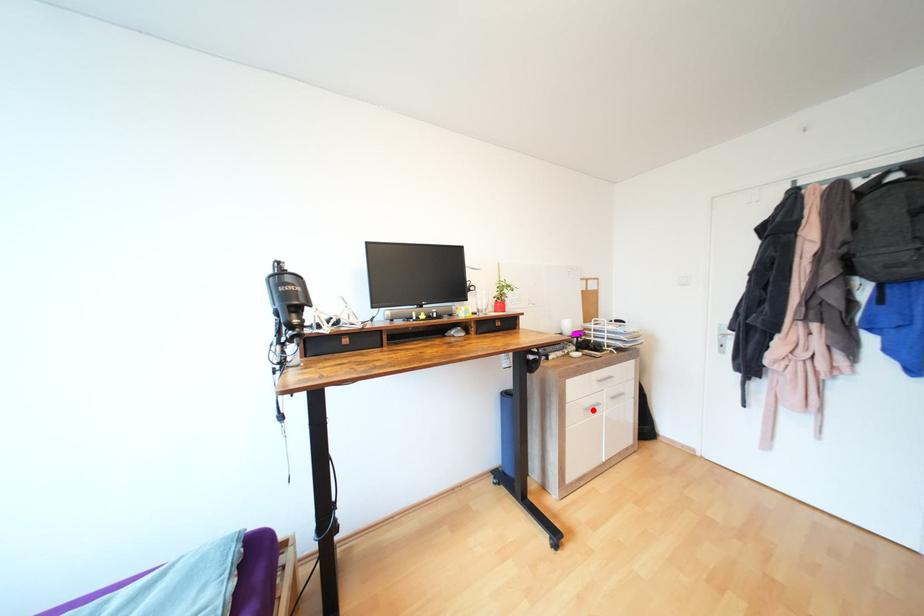
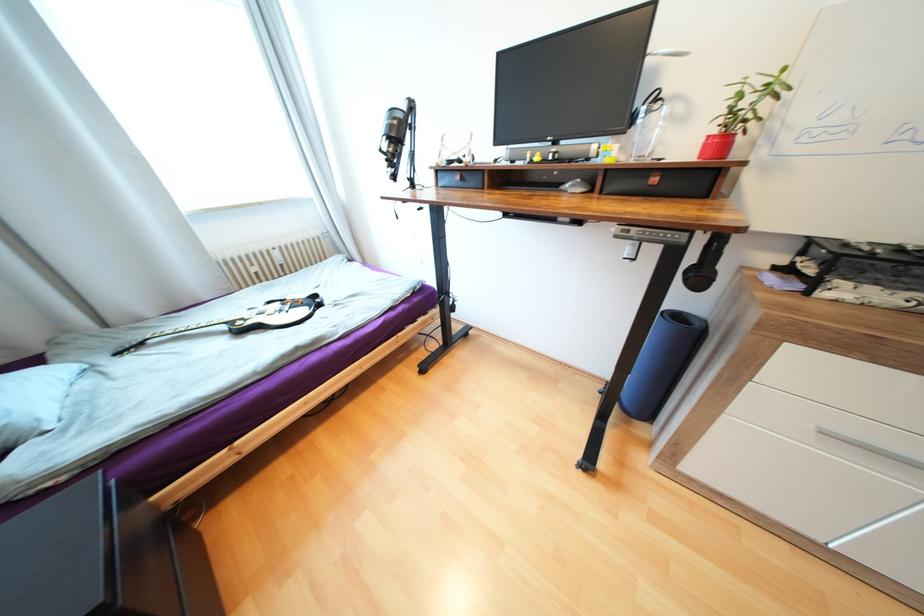
Question: I am providing you with two images of the same scene from different viewpoints. A red point is shown in image1. For the corresponding object point in image2, is it positioned nearer or farther from the camera?

Choices:
 (A) Nearer
 (B) Farther

Answer: (A)